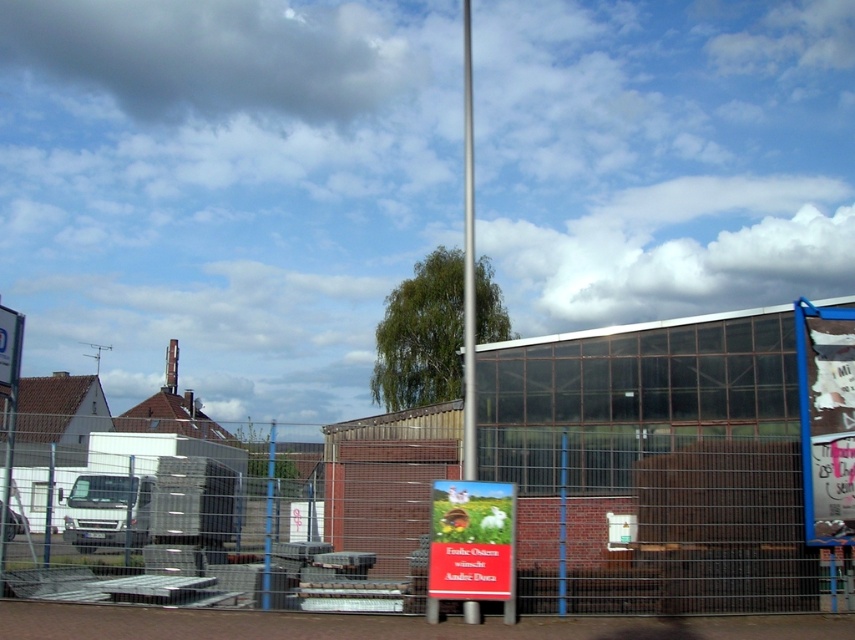
Question: Does metallic wire mesh fence at center appear on the left side of metallic pole at center?

Choices:
 (A) yes
 (B) no

Answer: (B)

Question: Estimate the real-world distances between objects in this image. Which object is farther from the metallic pole at center?

Choices:
 (A) white paper sign at center
 (B) metallic flag pole at center
 (C) metallic wire mesh fence at center

Answer: (B)

Question: Estimate the real-world distances between objects in this image. Which object is farther from the metallic pole at center?

Choices:
 (A) metallic wire mesh fence at center
 (B) metallic flag pole at center

Answer: (B)

Question: Which point is closer to the camera?

Choices:
 (A) pos(492,502)
 (B) pos(268,529)
 (C) pos(470,216)
 (D) pos(771,500)

Answer: (A)

Question: Does white paper sign at center appear over metallic pole at center?

Choices:
 (A) yes
 (B) no

Answer: (A)

Question: Is metallic wire mesh fence at center further to the viewer compared to metallic pole at center?

Choices:
 (A) yes
 (B) no

Answer: (B)